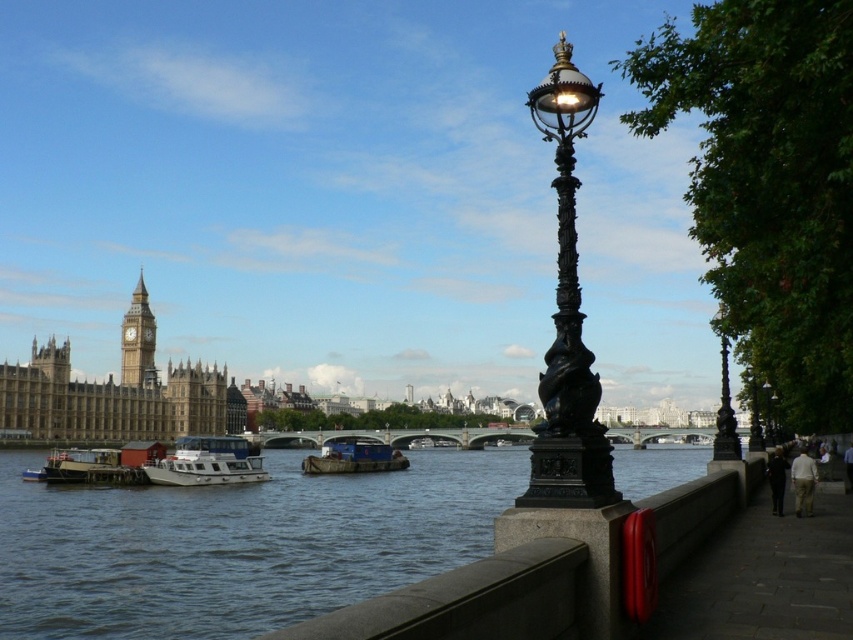
Can you confirm if black wrought iron street light at center is taller than blue matte barge at center?

Correct, black wrought iron street light at center is much taller as blue matte barge at center.

Consider the image. Does black wrought iron street light at center have a greater width compared to blue matte barge at center?

Yes, black wrought iron street light at center is wider than blue matte barge at center.

Is point (583, 92) positioned after point (314, 456)?

That is False.

I want to click on black wrought iron street light at center, so click(x=567, y=320).

The width and height of the screenshot is (853, 640). What do you see at coordinates (567, 320) in the screenshot?
I see `black wrought iron street light at center` at bounding box center [567, 320].

Which of these two, black wrought iron street light at center or stone clock tower at upper left, stands taller?

black wrought iron street light at center

Is point (572, 182) less distant than point (151, 330)?

Yes, it is in front of point (151, 330).

In order to click on black wrought iron street light at center in this screenshot , I will do `click(567, 320)`.

Can you confirm if black wrought iron street light at center is shorter than white matte boat at lower left?

In fact, black wrought iron street light at center may be taller than white matte boat at lower left.

Can you confirm if black wrought iron street light at center is positioned to the right of white matte boat at lower left?

Correct, you'll find black wrought iron street light at center to the right of white matte boat at lower left.

Locate an element on the screen. black wrought iron street light at center is located at coordinates (567, 320).